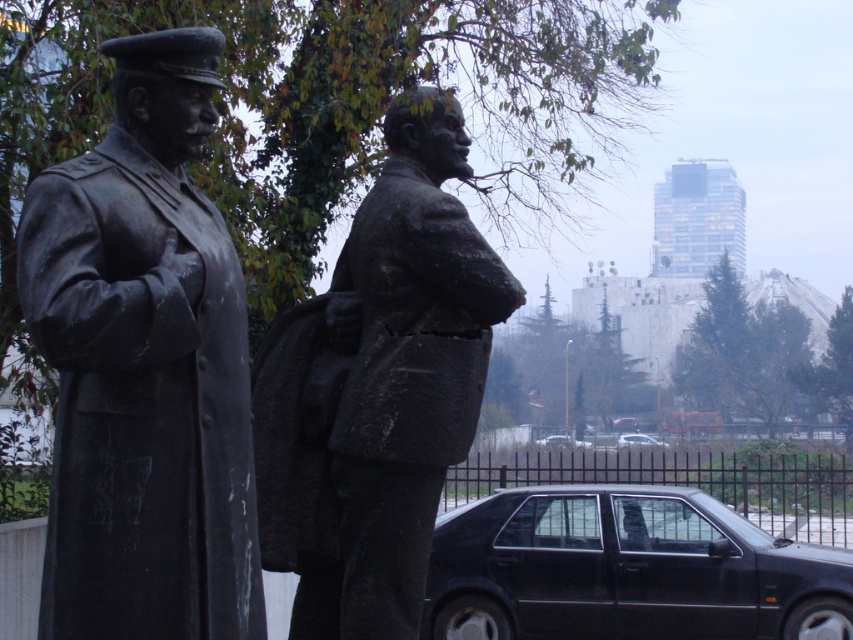
Question: Does bronze statue at left come in front of bronze statue at center?

Choices:
 (A) no
 (B) yes

Answer: (B)

Question: Does bronze statue at center have a lesser width compared to black glossy car at center?

Choices:
 (A) yes
 (B) no

Answer: (B)

Question: Among these points, which one is nearest to the camera?

Choices:
 (A) (543, 440)
 (B) (132, 154)
 (C) (619, 436)

Answer: (B)

Question: Is black matte car at lower right below shiny black sedan at center?

Choices:
 (A) yes
 (B) no

Answer: (A)

Question: Which point is closer to the camera?

Choices:
 (A) bronze statue at left
 (B) black glossy car at center
 (C) shiny black sedan at center
 (D) bronze statue at center

Answer: (A)

Question: Which point is farther to the camera?

Choices:
 (A) (612, 426)
 (B) (125, 44)
 (C) (548, 442)

Answer: (C)